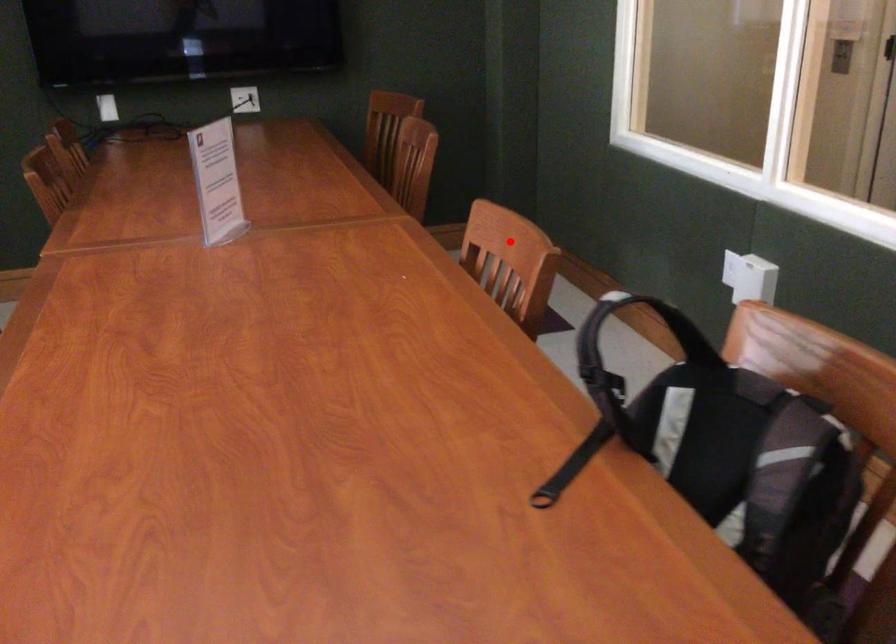
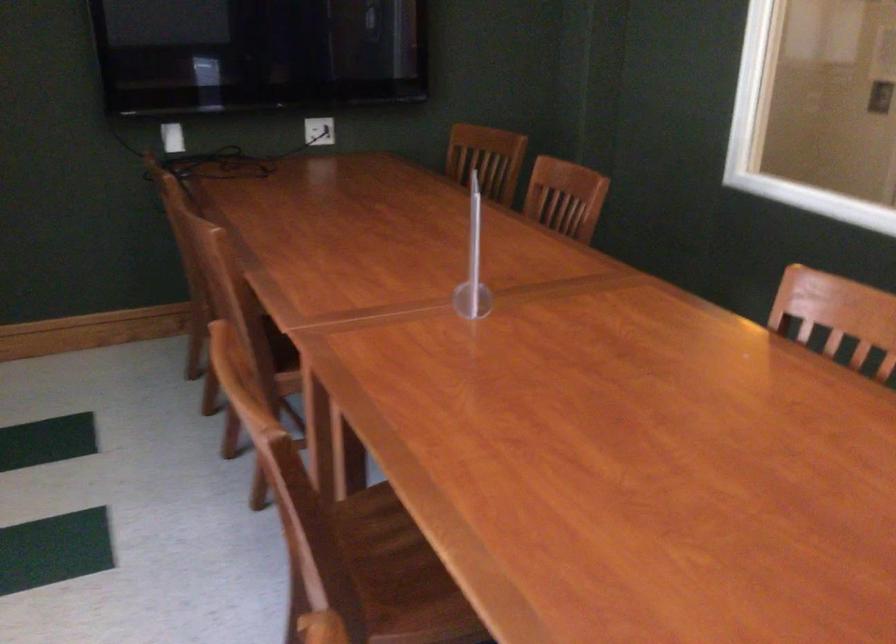
The point at the highlighted location is marked in the first image. Where is the corresponding point in the second image?

(841, 313)